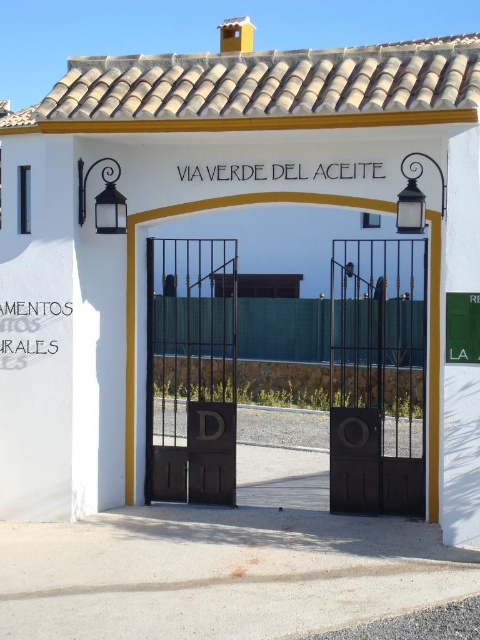
You are a delivery person trying to enter the property at VIA VERDE DEL ACEITE. You see the brown matte door at center and the dark brown wrought iron gate at center. Which object do you need to open first to access the door?

The brown matte door at center is positioned under the dark brown wrought iron gate at center, so you must open the dark brown wrought iron gate at center first to access the brown matte door at center.

You are a delivery person with a large cart that is 1.5 meters wide. You need to enter through the gate. Which gate, the black metal gate at center or the dark brown wrought iron gate at center, can your cart fit through?

The black metal gate at center might be wider than dark brown wrought iron gate at center, so the cart can fit through the black metal gate at center if it is indeed wider.